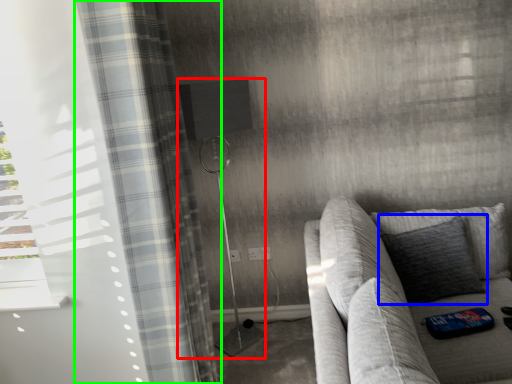
Question: Which object is the farthest from shower (highlighted by a red box)? Choose among these: pillow (highlighted by a blue box) or curtain (highlighted by a green box).

Choices:
 (A) pillow
 (B) curtain

Answer: (A)